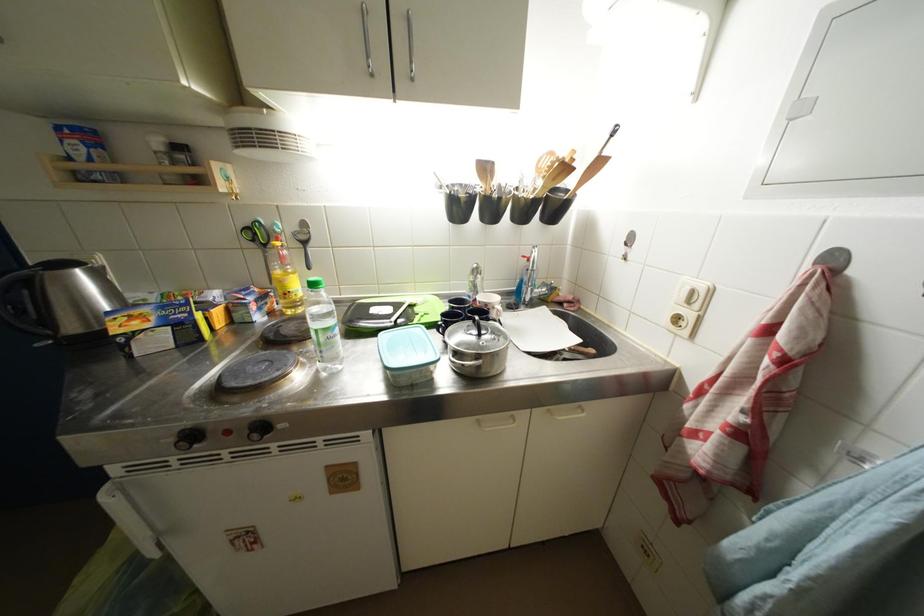
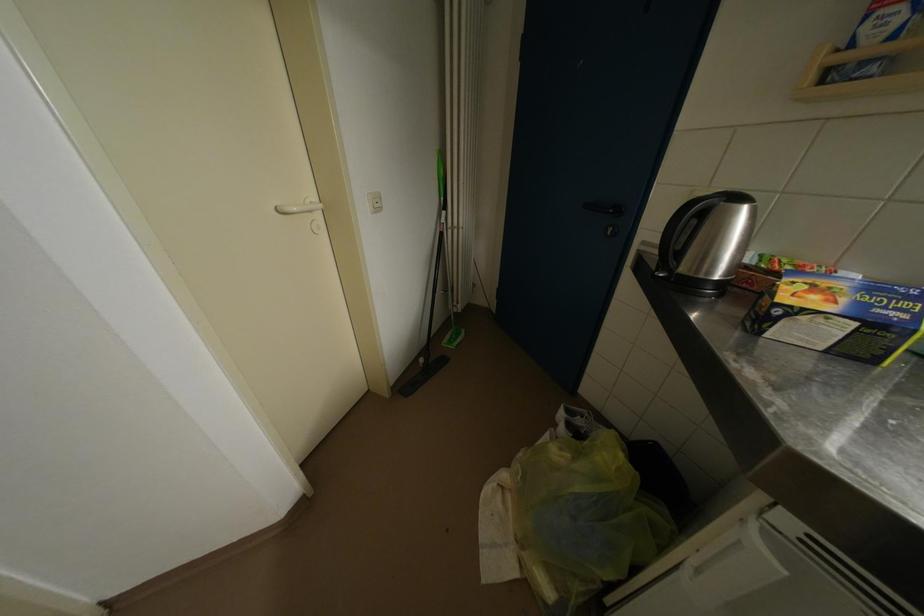
Where in the second image is the point corresponding to pixel 84 276 from the first image?

(752, 213)